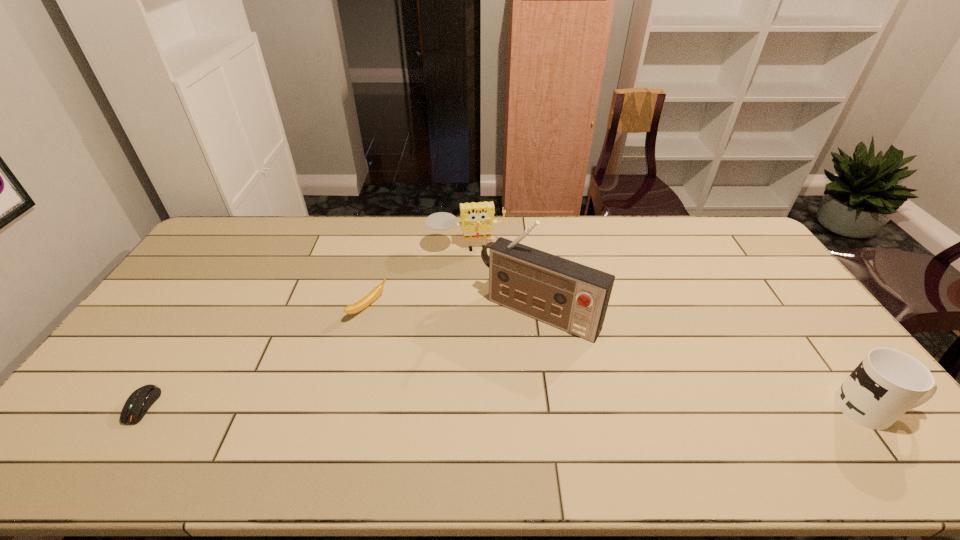
The height and width of the screenshot is (540, 960). In order to click on free space located on the front-facing side of the sponge in this screenshot , I will do [x=484, y=342].

Image resolution: width=960 pixels, height=540 pixels. Find the location of `free space located 0.150m on the front-facing side of the sponge`. free space located 0.150m on the front-facing side of the sponge is located at coordinates (475, 287).

Find the location of a particular element. The width and height of the screenshot is (960, 540). vacant space located 0.390m on the front-facing side of the sponge is located at coordinates tap(484, 342).

At what (x,y) coordinates should I click in order to perform the action: click on vacant space located on the front panel of the tallest object. Please return your answer as a coordinate pair (x, y). Looking at the image, I should click on (486, 375).

Identify the location of vacant point located 0.290m on the front panel of the tallest object. click(x=458, y=415).

This screenshot has height=540, width=960. In order to click on vacant space located on the front panel of the tallest object in this screenshot , I will do `click(480, 383)`.

The image size is (960, 540). Identify the location of object that is at the far edge. (477, 219).

In order to click on computer equipment that is at the near edge in this screenshot , I will do `click(139, 402)`.

The width and height of the screenshot is (960, 540). In order to click on mug that is at the near edge in this screenshot , I will do `click(887, 383)`.

In order to click on object that is at the left edge in this screenshot , I will do `click(139, 402)`.